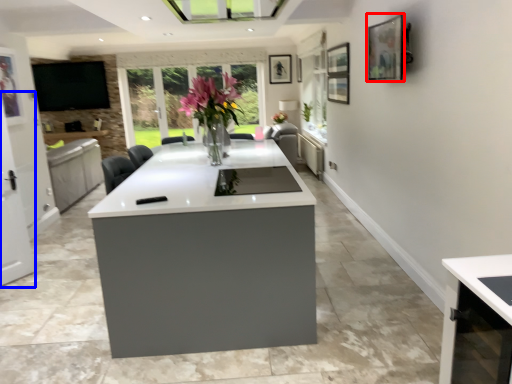
Question: Which object is further to the camera taking this photo, picture frame (highlighted by a red box) or screen door (highlighted by a blue box)?

Choices:
 (A) picture frame
 (B) screen door

Answer: (B)